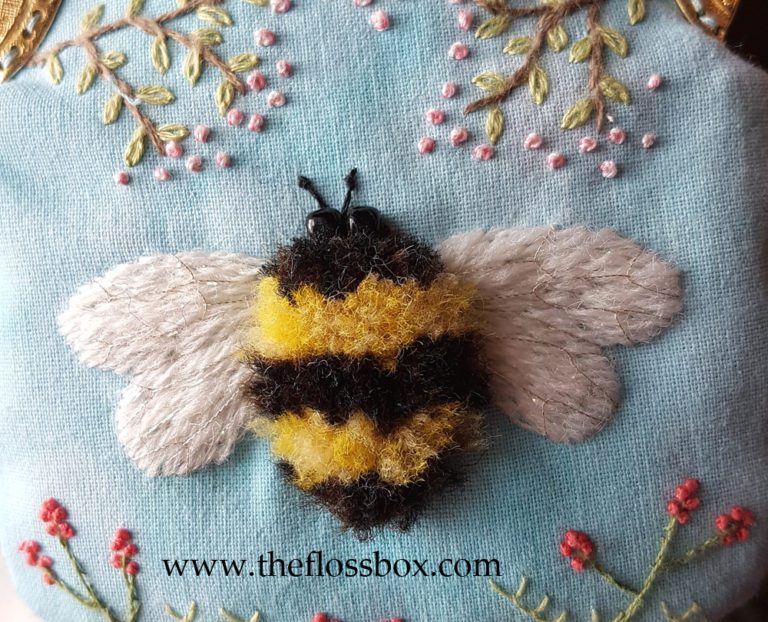
Identify the location of embroidery fabric. Image resolution: width=768 pixels, height=622 pixels. (206, 211).